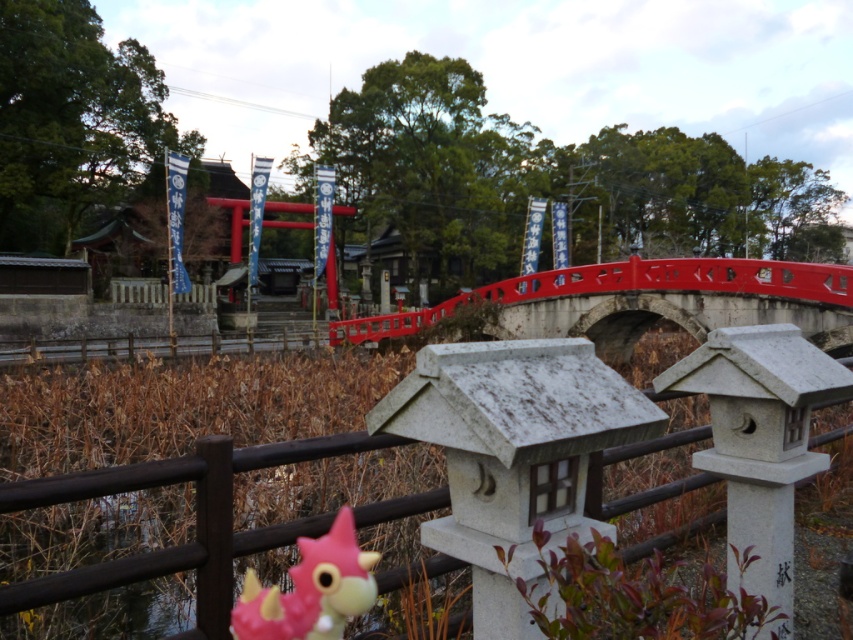
Question: Which point is farther to the camera?

Choices:
 (A) smooth stone bridge at center
 (B) pink matte toy at center
 (C) brown wooden fence at lower center

Answer: (A)

Question: Which object is the closest to the pink matte toy at center?

Choices:
 (A) smooth stone bridge at center
 (B) brown wooden fence at lower center

Answer: (B)

Question: Does smooth stone bridge at center have a larger size compared to pink matte toy at center?

Choices:
 (A) no
 (B) yes

Answer: (B)

Question: Can you confirm if brown wooden fence at lower center is positioned to the right of pink matte toy at center?

Choices:
 (A) no
 (B) yes

Answer: (A)

Question: Which of the following is the closest to the observer?

Choices:
 (A) (351, 554)
 (B) (45, 476)

Answer: (A)

Question: Can you confirm if smooth stone bridge at center is thinner than pink matte toy at center?

Choices:
 (A) no
 (B) yes

Answer: (A)